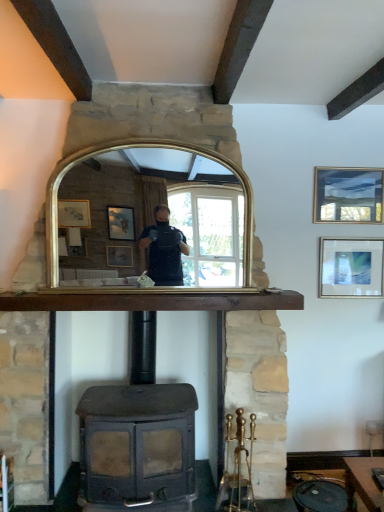
Question: Looking at their shapes, would you say matte black wood burning stove at center is wider or thinner than matte gold picture frame at upper right, the second picture frame ordered from the bottom?

Choices:
 (A) wide
 (B) thin

Answer: (A)

Question: Is matte black wood burning stove at center in front of or behind matte gold picture frame at upper right, which ranks as the 1th picture frame in top-to-bottom order, in the image?

Choices:
 (A) front
 (B) behind

Answer: (A)

Question: Which object is the closest to the brown wooden mantle at center?

Choices:
 (A) matte black wood burning stove at center
 (B) matte gold picture frame at upper right, which ranks as the 1th picture frame in top-to-bottom order
 (C) gold-framed mirror at center
 (D) matte silver picture frame at upper right, which appears as the second picture frame when viewed from the top

Answer: (C)

Question: Estimate the real-world distances between objects in this image. Which object is farther from the matte black wood burning stove at center?

Choices:
 (A) matte silver picture frame at upper right, the first picture frame in the bottom-to-top sequence
 (B) gold-framed mirror at center
 (C) matte gold picture frame at upper right, which ranks as the 1th picture frame in top-to-bottom order
 (D) brown wooden mantle at center

Answer: (C)